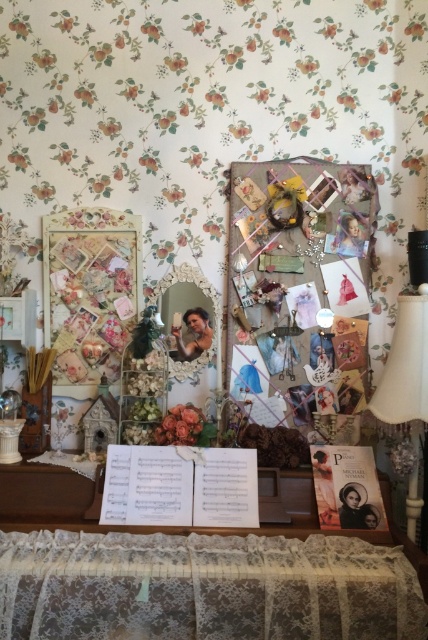
You are an interior designer planning to hang a new painting in this vintage corner. The painting you have is 1.2 meters wide. You want to place it between the floral paper collage at left and the matte floral bouquet at center. Considering their heights, which object should you avoid placing the painting too close to?

The floral paper collage at left is much taller than the matte floral bouquet at center. To avoid the painting being overshadowed by the taller object, you should avoid placing it too close to the floral paper collage at left.

You are an interior designer planning to add a new shelf between the floral paper collage at left and the matte floral bouquet at center. The shelf you have in mind is 18 inches long. Do you think the shelf will fit between them without overlapping either object?

The distance between the floral paper collage at left and the matte floral bouquet at center is 20.11 inches. Since the shelf is only 18 inches long, there will be enough space to place it between them without overlapping either object.